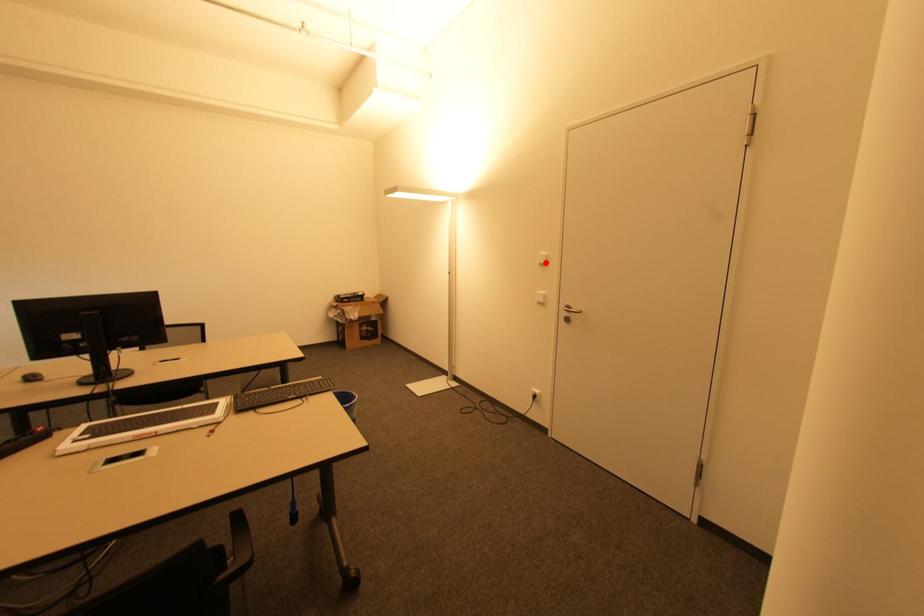
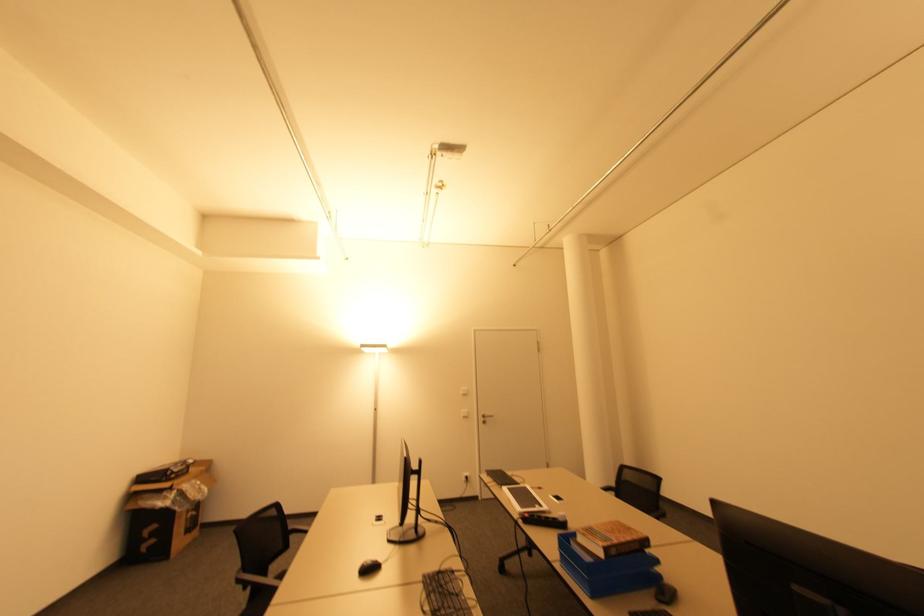
In the second image, find the point that corresponds to the highlighted location in the first image.

(468, 392)